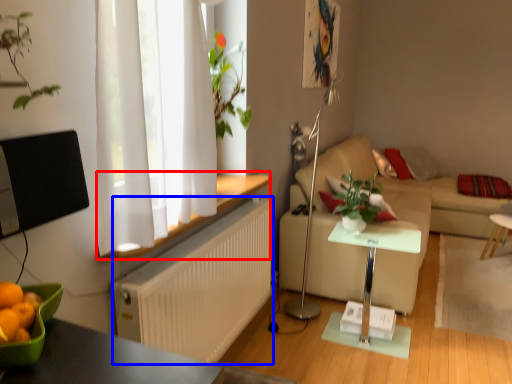
Question: Which of the following is the closest to the observer, window sill (highlighted by a red box) or radiator (highlighted by a blue box)?

Choices:
 (A) window sill
 (B) radiator

Answer: (A)